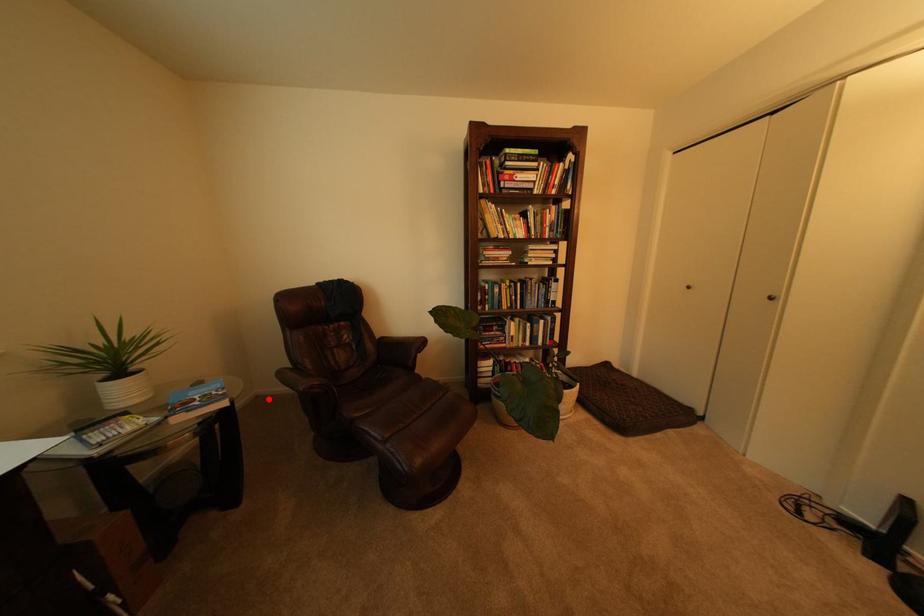
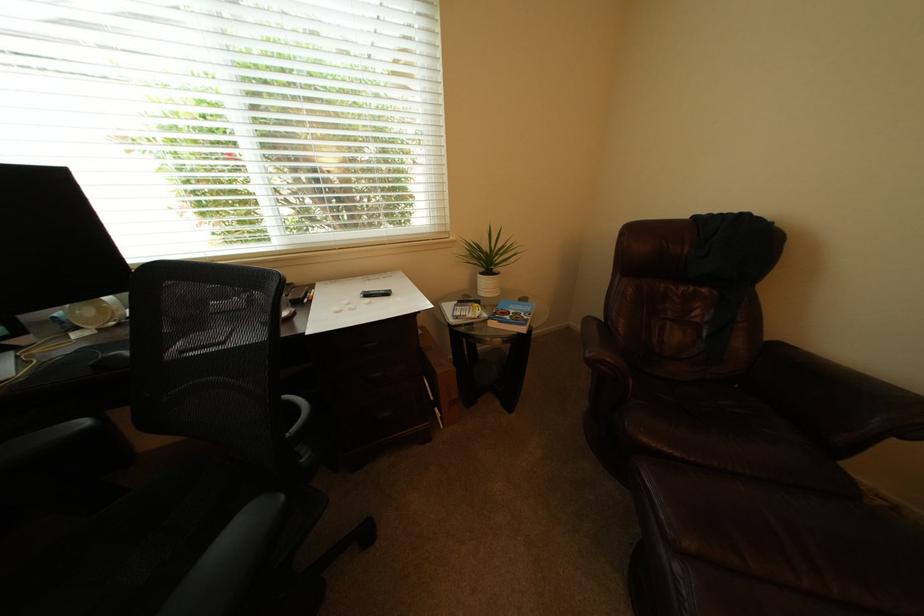
Where in the second image is the point corresponding to the highlighted location from the first image?

(579, 331)